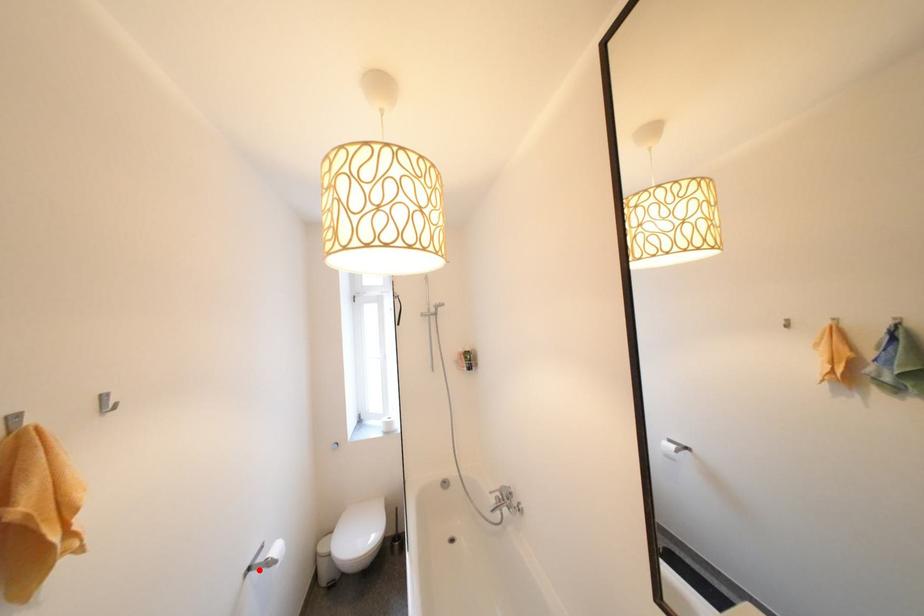
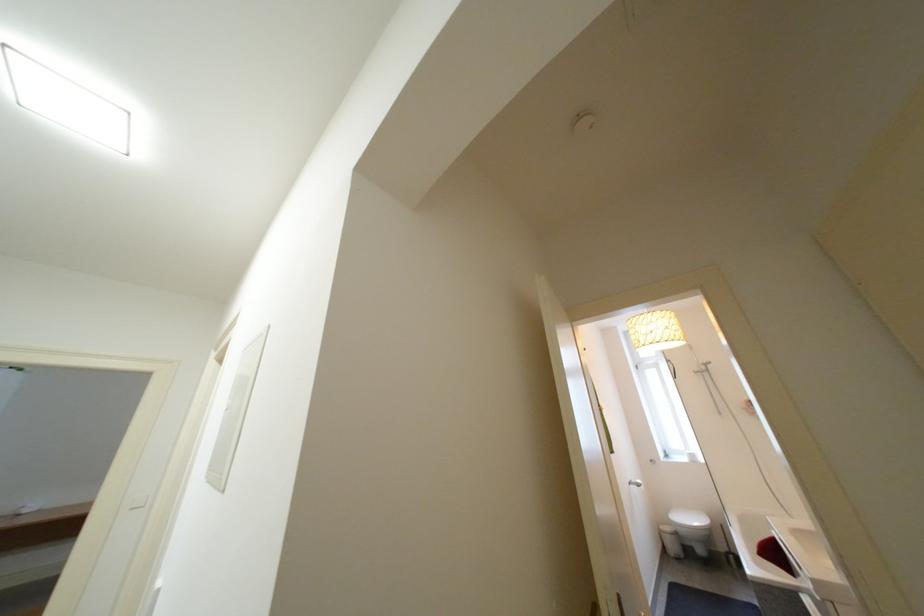
In the second image, find the point that corresponds to the highlighted location in the first image.

(639, 485)